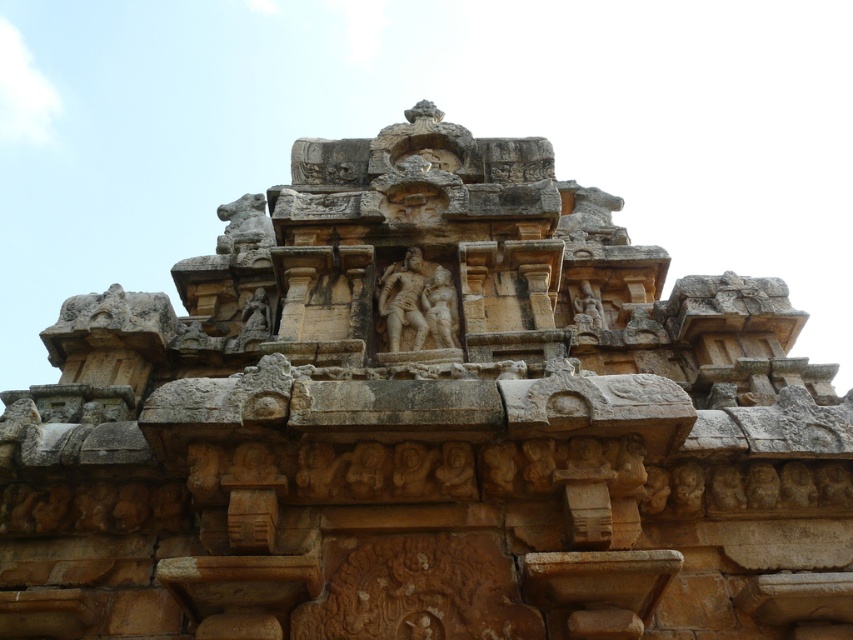
Which is more to the right, stone carved sculpture at center or carved stone statue at upper right?

carved stone statue at upper right

Is the position of stone carved sculpture at center less distant than that of carved stone statue at upper right?

That is True.

Which is behind, point (387, 356) or point (577, 314)?

The point (577, 314) is behind.

Where is `stone carved sculpture at center`? The width and height of the screenshot is (853, 640). stone carved sculpture at center is located at coordinates (416, 305).